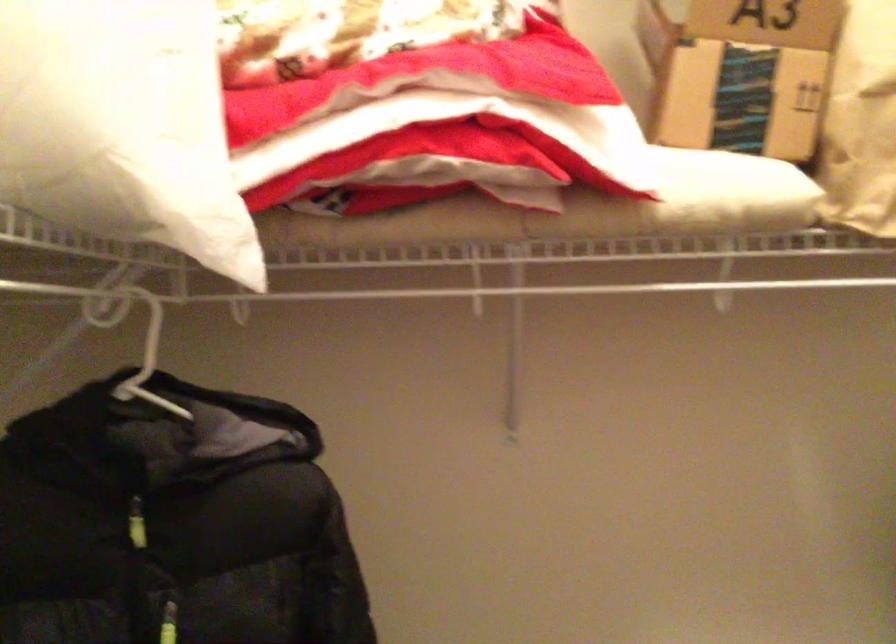
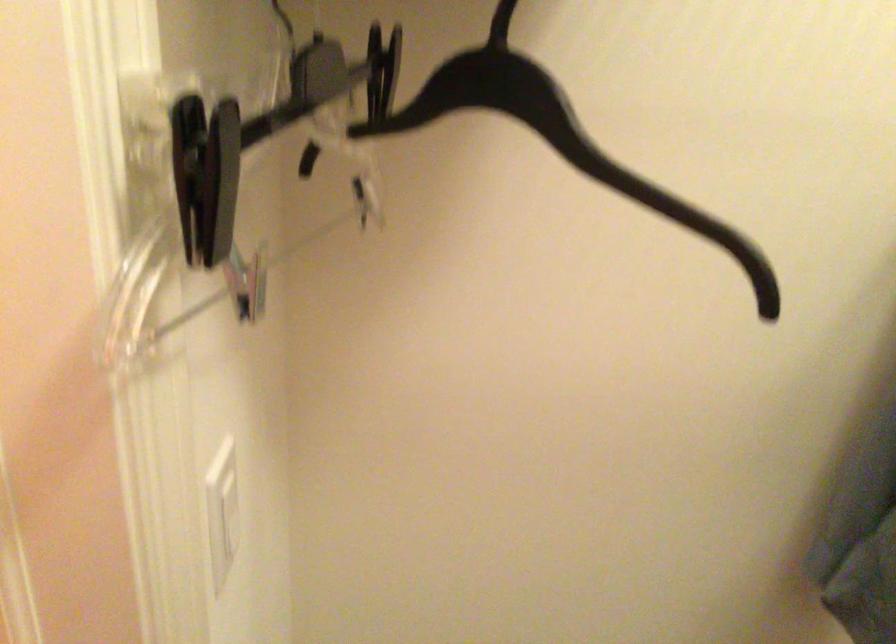
The images are taken continuously from a first-person perspective. In which direction is your viewpoint rotating?

The rotation direction of the camera is left-down.